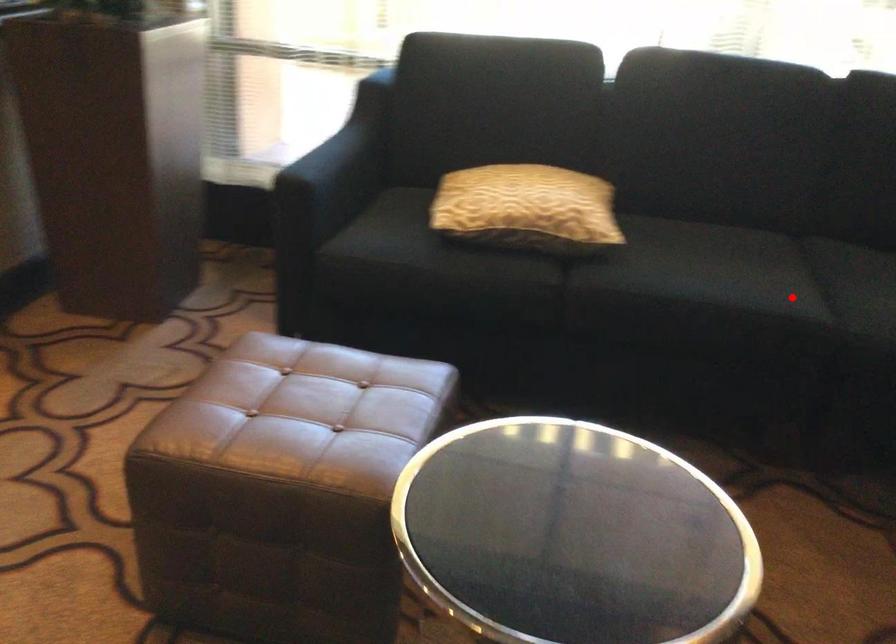
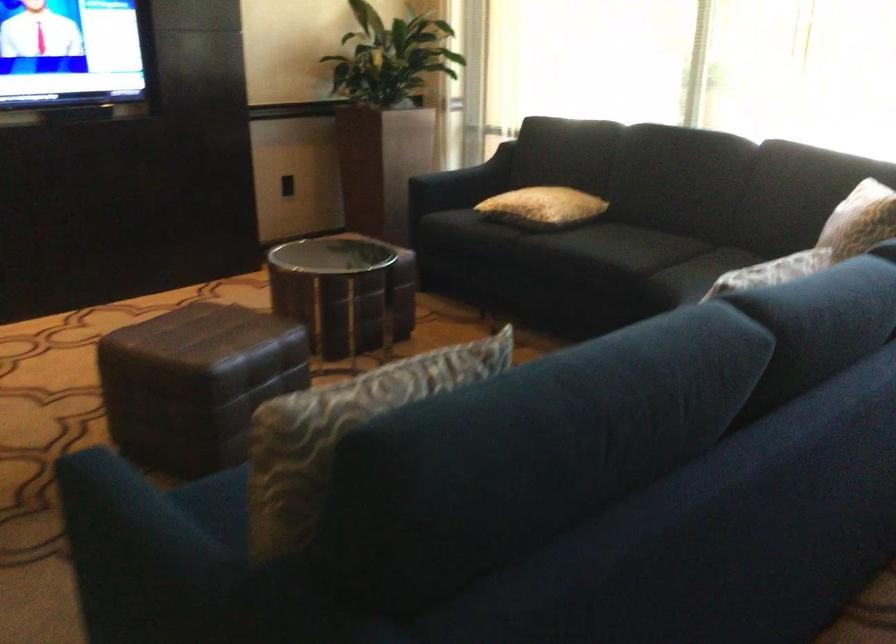
The point at the highlighted location is marked in the first image. Where is the corresponding point in the second image?

(626, 254)